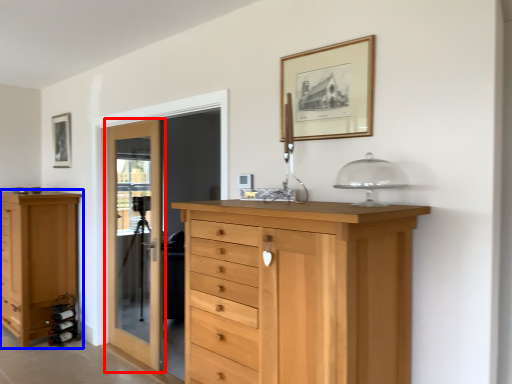
Question: Among these objects, which one is nearest to the camera, door (highlighted by a red box) or chest of drawers (highlighted by a blue box)?

Choices:
 (A) door
 (B) chest of drawers

Answer: (A)